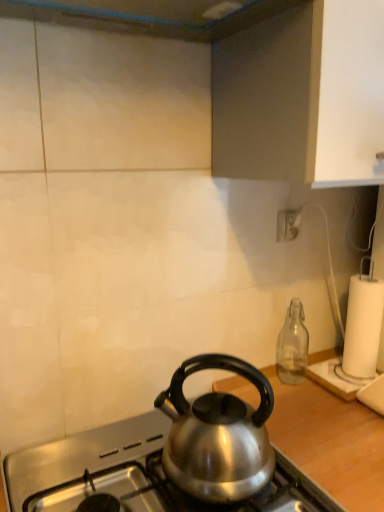
Question: Is white plastic power outlet at upper right a part of satin silver kettle at center?

Choices:
 (A) no
 (B) yes

Answer: (A)

Question: Is satin silver kettle at center not near white plastic power outlet at upper right?

Choices:
 (A) no
 (B) yes

Answer: (A)

Question: Could you tell me if satin silver kettle at center is turned towards white plastic power outlet at upper right?

Choices:
 (A) yes
 (B) no

Answer: (B)

Question: Does satin silver kettle at center have a lesser width compared to white plastic power outlet at upper right?

Choices:
 (A) yes
 (B) no

Answer: (B)

Question: Is white plastic power outlet at upper right at the back of satin silver kettle at center?

Choices:
 (A) no
 (B) yes

Answer: (A)

Question: From the image's perspective, is satin silver kettle at center above white plastic power outlet at upper right?

Choices:
 (A) no
 (B) yes

Answer: (A)

Question: From a real-world perspective, is shiny metallic kettle at center positioned over satin silver kettle at center based on gravity?

Choices:
 (A) yes
 (B) no

Answer: (B)

Question: Considering the relative sizes of shiny metallic kettle at center and satin silver kettle at center in the image provided, is shiny metallic kettle at center wider than satin silver kettle at center?

Choices:
 (A) no
 (B) yes

Answer: (B)

Question: Can you confirm if shiny metallic kettle at center is thinner than satin silver kettle at center?

Choices:
 (A) yes
 (B) no

Answer: (B)

Question: From the image's perspective, is shiny metallic kettle at center above satin silver kettle at center?

Choices:
 (A) no
 (B) yes

Answer: (A)

Question: Could you tell me if shiny metallic kettle at center is turned towards satin silver kettle at center?

Choices:
 (A) yes
 (B) no

Answer: (B)

Question: Is shiny metallic kettle at center placed right next to satin silver kettle at center?

Choices:
 (A) yes
 (B) no

Answer: (B)

Question: From a real-world perspective, is satin silver kettle at center beneath white paper at right?

Choices:
 (A) yes
 (B) no

Answer: (A)